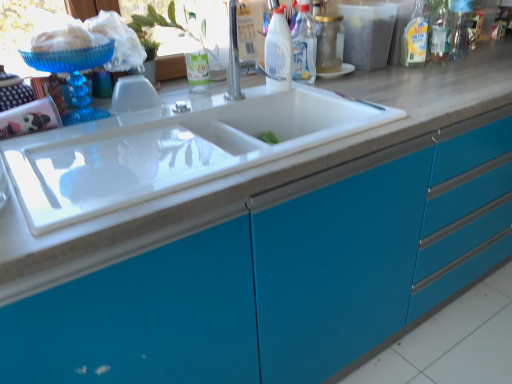
Locate an element on the screen. This screenshot has width=512, height=384. vacant space to the right of clear plastic bottle at upper right, acting as the fourth bottle starting from the left is located at coordinates (486, 55).